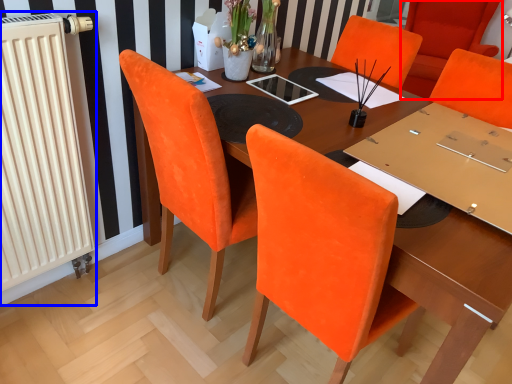
Question: Which point is further to the camera, chair (highlighted by a red box) or radiator (highlighted by a blue box)?

Choices:
 (A) chair
 (B) radiator

Answer: (A)